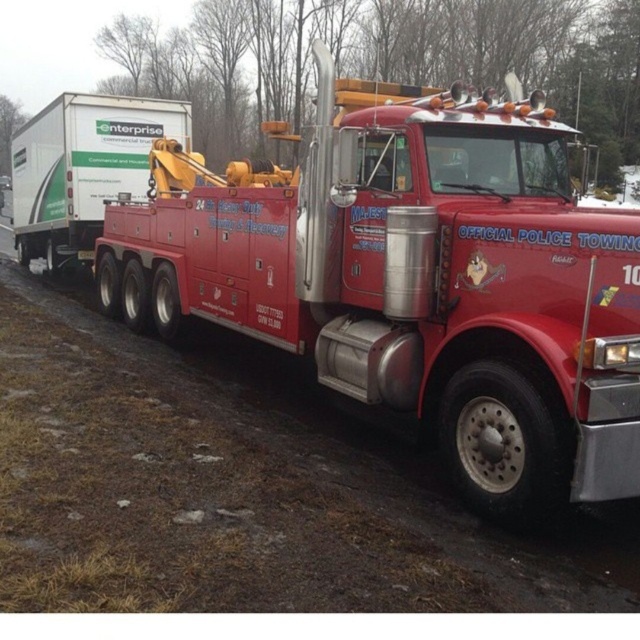
Question: Which point is closer to the camera?

Choices:
 (A) click(x=17, y=193)
 (B) click(x=323, y=116)

Answer: (B)

Question: Is shiny red tow truck at center to the left of white matte trailer at left from the viewer's perspective?

Choices:
 (A) no
 (B) yes

Answer: (A)

Question: Which point appears farthest from the camera in this image?

Choices:
 (A) (280, 237)
 (B) (116, 131)

Answer: (B)

Question: Considering the relative positions of shiny red tow truck at center and white matte trailer at left in the image provided, where is shiny red tow truck at center located with respect to white matte trailer at left?

Choices:
 (A) left
 (B) right

Answer: (B)

Question: Does shiny red tow truck at center have a greater width compared to white matte trailer at left?

Choices:
 (A) yes
 (B) no

Answer: (B)

Question: Which object is farther from the camera taking this photo?

Choices:
 (A) shiny red tow truck at center
 (B) white matte trailer at left

Answer: (B)